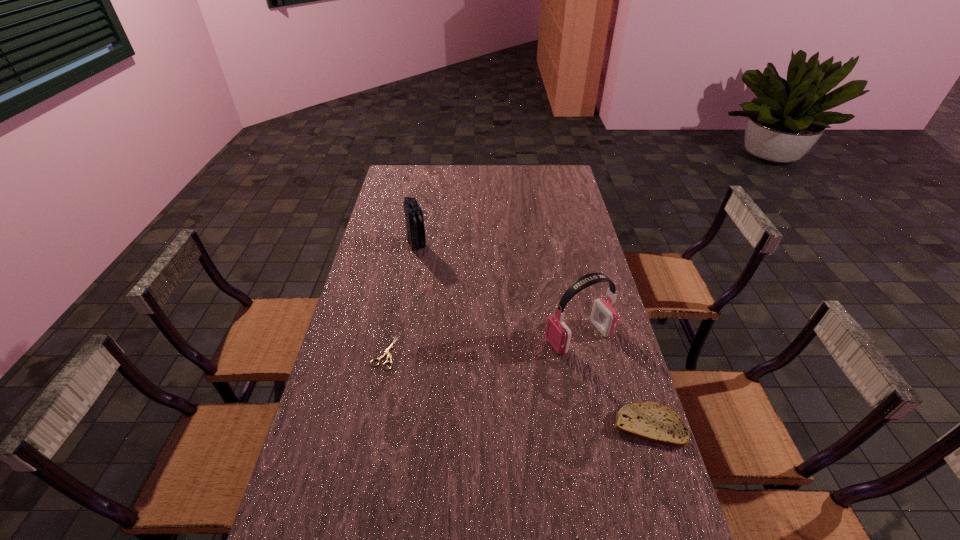
The image size is (960, 540). Find the location of `shears`. shears is located at coordinates (387, 352).

This screenshot has height=540, width=960. Find the location of `the second shortest object`. the second shortest object is located at coordinates (648, 421).

In order to click on pita bread in this screenshot , I will do `click(648, 421)`.

Locate an element on the screen. Image resolution: width=960 pixels, height=540 pixels. the third shortest object is located at coordinates (416, 238).

This screenshot has width=960, height=540. Identify the location of the farthest object. (416, 238).

This screenshot has height=540, width=960. Identify the location of earphone. (604, 316).

The image size is (960, 540). Identify the location of vacant space located 0.050m on the left of the shortest object. (357, 353).

Find the location of a particular element. The width and height of the screenshot is (960, 540). vacant space situated 0.180m on the left of the second shortest object is located at coordinates (545, 426).

Identify the location of vacant region located with the zip open on the clutch bag. (423, 260).

You are a GUI agent. You are given a task and a screenshot of the screen. Output one action in this format:
    pyautogui.click(x=<x>, y=<y>)
    Task: Click on the vacant space located with the zip open on the clutch bag
    The height and width of the screenshot is (540, 960).
    Given the screenshot: What is the action you would take?
    pyautogui.click(x=424, y=261)